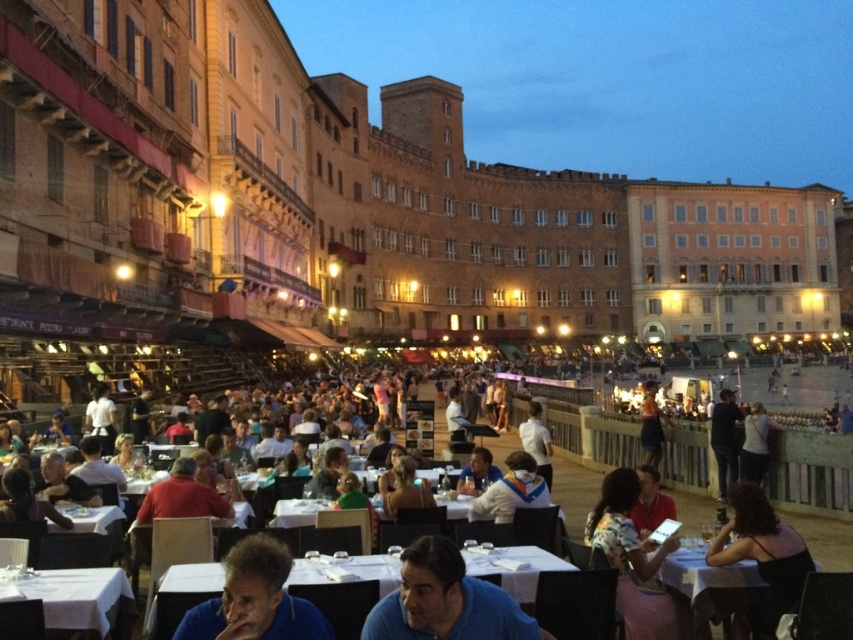
Image resolution: width=853 pixels, height=640 pixels. What are the coordinates of `white tablecloth at lower center` in the screenshot? It's located at (515, 570).

Where is `white tablecloth at lower center`? white tablecloth at lower center is located at coordinates (515, 570).

The height and width of the screenshot is (640, 853). What do you see at coordinates (515, 570) in the screenshot?
I see `white tablecloth at lower center` at bounding box center [515, 570].

Is point (202, 576) closer to camera compared to point (750, 472)?

Yes, point (202, 576) is closer to viewer.

At what (x,y) coordinates should I click in order to perform the action: click on white tablecloth at lower center. Please return your answer as a coordinate pair (x, y). Looking at the image, I should click on (515, 570).

Between point (845, 449) and point (682, 572), which one is positioned in front?

Point (682, 572) is in front.

Who is positioned more to the left, white fabric table at lower center or white glossy table at lower right?

Positioned to the left is white glossy table at lower right.

Between point (674, 452) and point (757, 600), which one is positioned behind?

The point (674, 452) is more distant.

I want to click on white fabric table at lower center, so point(814,488).